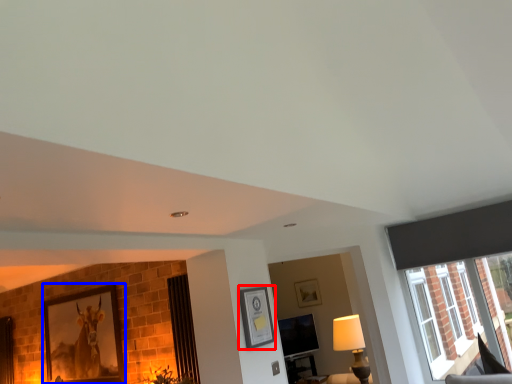
Question: Which of the following is the closest to the observer, picture frame (highlighted by a red box) or picture frame (highlighted by a blue box)?

Choices:
 (A) picture frame
 (B) picture frame

Answer: (A)